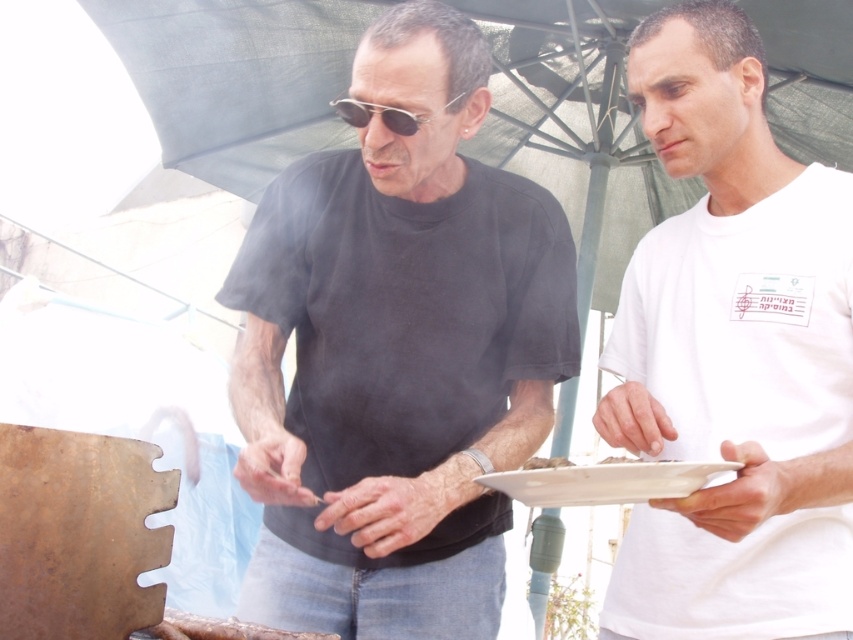
Where is the black matte shirt at center located in the image?

The black matte shirt at center is located at point (396, 353) in the image.